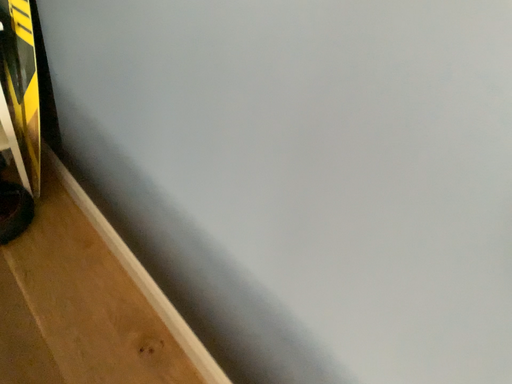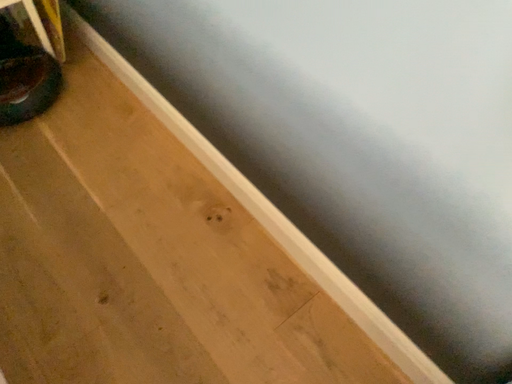
Question: How did the camera likely rotate when shooting the video?

Choices:
 (A) rotated downward
 (B) rotated upward

Answer: (A)